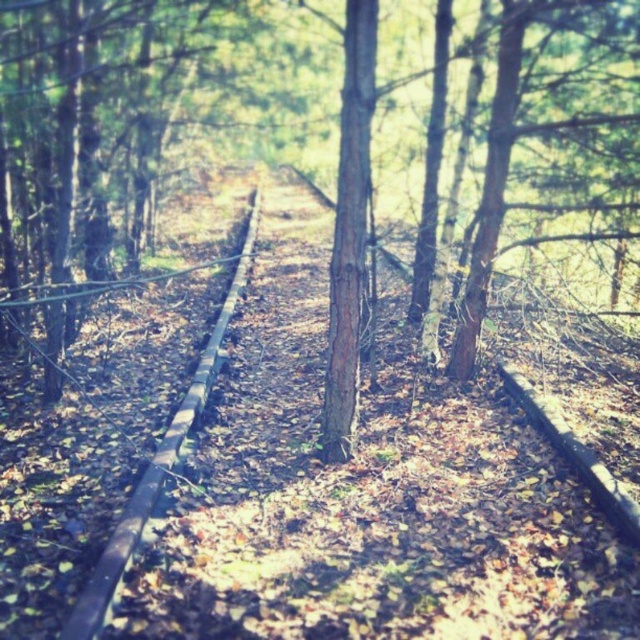
You are standing in the forest and see the brown rough bark tree at center and the brown wooden train track at center. Which object is closer to you?

The brown rough bark tree at center is closer to you because the brown wooden train track at center is behind it.

You are standing at the center of the old railway track and see the brown rough bark tree at center. If you walk straight ahead along the track, will the tree remain in your line of sight?

The brown rough bark tree at center is positioned at point (349,230), which is directly ahead along the track. Therefore, walking straight ahead along the track will keep the tree in your line of sight.